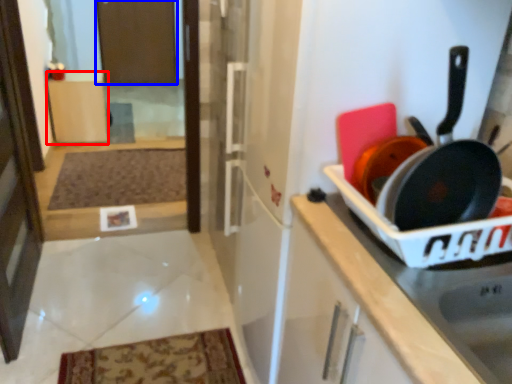
Question: Which object is further to the camera taking this photo, cabinetry (highlighted by a red box) or screen door (highlighted by a blue box)?

Choices:
 (A) cabinetry
 (B) screen door

Answer: (B)